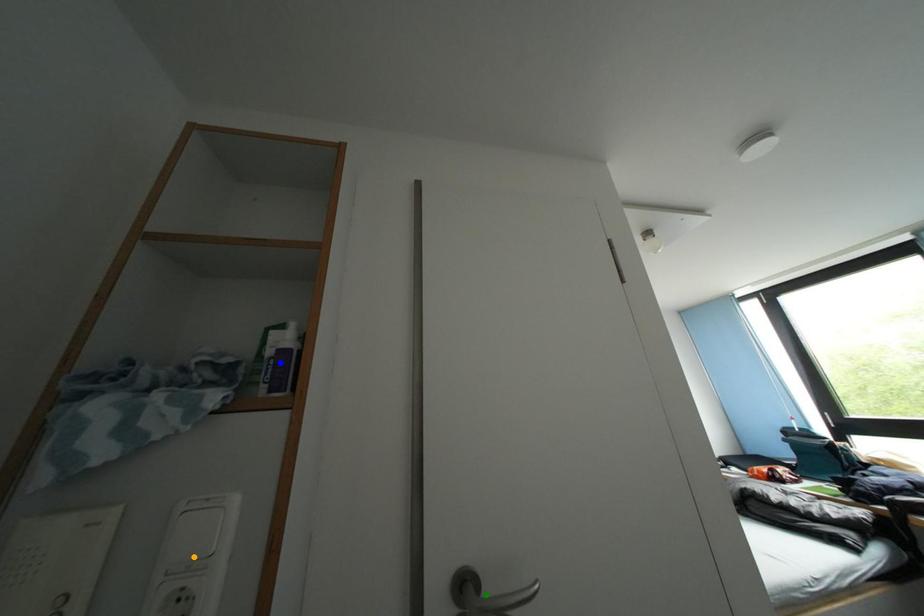
Order these from nearest to farthest:
green point | blue point | orange point

orange point
green point
blue point